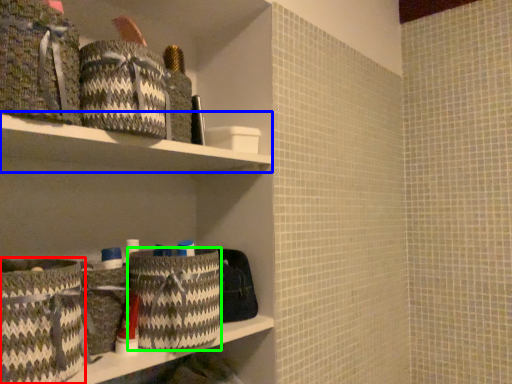
Question: Considering the real-world distances, which object is closest to basket (highlighted by a red box)? cabinet (highlighted by a blue box) or laundry basket (highlighted by a green box).

Choices:
 (A) cabinet
 (B) laundry basket

Answer: (B)